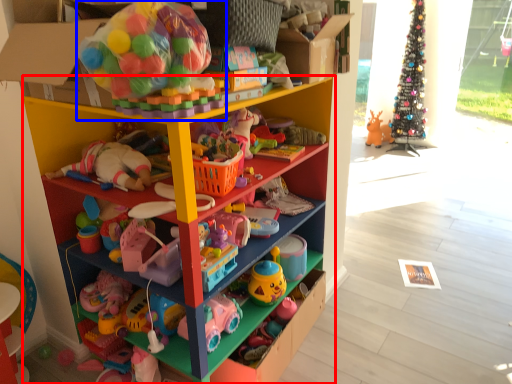
Question: Which object is further to the camera taking this photo, shelf (highlighted by a red box) or toy (highlighted by a blue box)?

Choices:
 (A) shelf
 (B) toy

Answer: (A)